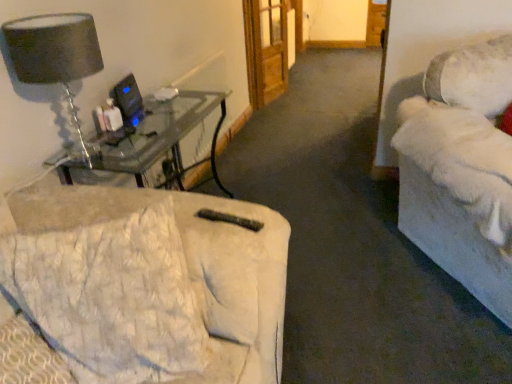
Find the location of `vacant space in front of wooden door at center`. vacant space in front of wooden door at center is located at coordinates (289, 102).